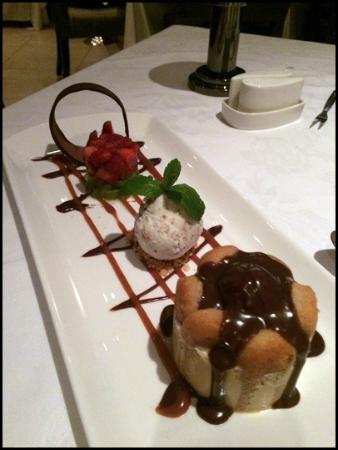
Locate an element on the screen. This screenshot has height=450, width=338. chair is located at coordinates (81, 24).